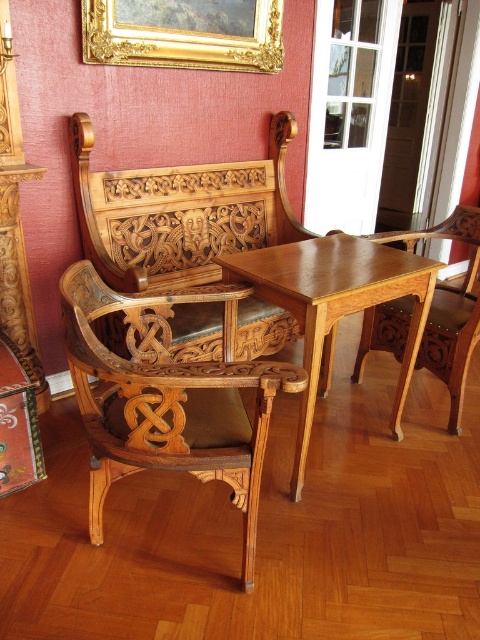
From the picture: Between light brown wood table at center and gold ornate picture frame at upper center, which one is positioned lower?

light brown wood table at center is below.

Between light brown wood table at center and gold ornate picture frame at upper center, which one appears on the right side from the viewer's perspective?

light brown wood table at center is more to the right.

Describe the element at coordinates (335, 307) in the screenshot. I see `light brown wood table at center` at that location.

Image resolution: width=480 pixels, height=640 pixels. I want to click on light brown wood table at center, so click(335, 307).

Between natural wood armchair at center and gold ornate picture frame at upper center, which one appears on the right side from the viewer's perspective?

gold ornate picture frame at upper center is more to the right.

Can you confirm if natural wood armchair at center is positioned above gold ornate picture frame at upper center?

Actually, natural wood armchair at center is below gold ornate picture frame at upper center.

The height and width of the screenshot is (640, 480). Describe the element at coordinates (165, 401) in the screenshot. I see `natural wood armchair at center` at that location.

This screenshot has height=640, width=480. In order to click on natural wood armchair at center in this screenshot , I will do `click(165, 401)`.

Is gold ornate picture frame at upper center below light brown wood armchair at center?

No.

Where is `gold ornate picture frame at upper center`? gold ornate picture frame at upper center is located at coordinates (183, 33).

Locate an element on the screen. The width and height of the screenshot is (480, 640). gold ornate picture frame at upper center is located at coordinates (183, 33).